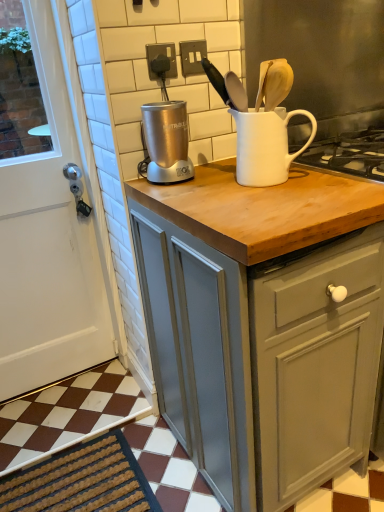
What are the coordinates of `empty space that is ontop of matte gray cabinet at center (from a real-world perspective)` in the screenshot? It's located at (254, 189).